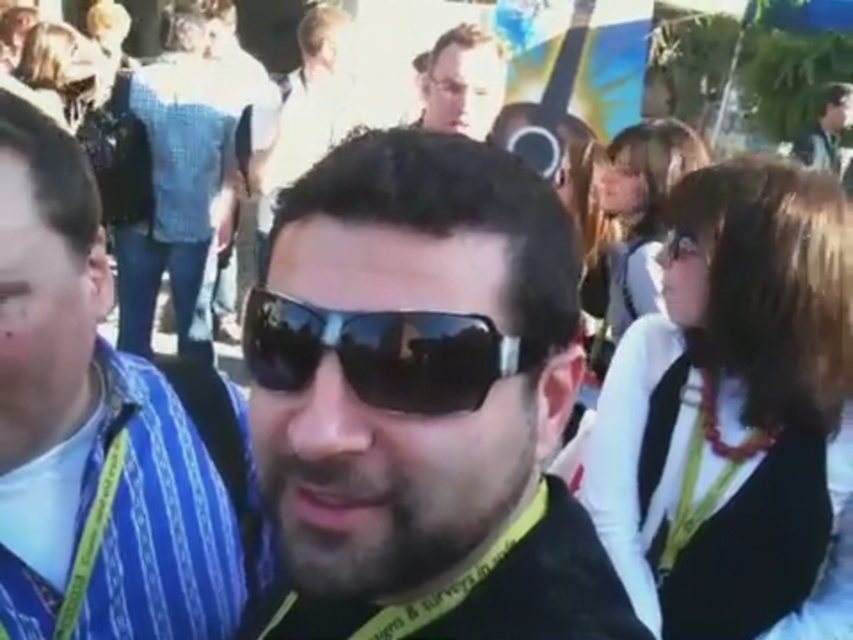
You are a GUI agent. You are given a task and a screenshot of the screen. Output one action in this format:
    pyautogui.click(x=<x>, y=<y>)
    Task: Click on the blue striped shirt at left
    Image resolution: width=853 pixels, height=640 pixels.
    Given the screenshot: What is the action you would take?
    pyautogui.click(x=96, y=417)

The height and width of the screenshot is (640, 853). What do you see at coordinates (96, 417) in the screenshot?
I see `blue striped shirt at left` at bounding box center [96, 417].

Identify the location of blue striped shirt at left. Image resolution: width=853 pixels, height=640 pixels. (96, 417).

Who is more forward, (247, 320) or (492, 108)?

Point (247, 320) is in front.

Is black reflective sunglasses at center closer to camera compared to matte black hair at upper center?

Yes.

Is point (344, 374) behind point (440, 109)?

That is False.

Where is `black reflective sunglasses at center`? black reflective sunglasses at center is located at coordinates (383, 353).

Between black matte sunglasses at center and black reflective sunglasses at center, which one appears on the right side from the viewer's perspective?

black matte sunglasses at center is more to the right.

Does point (517, 422) come behind point (293, 365)?

That is True.

Where is `black matte sunglasses at center`? The image size is (853, 640). black matte sunglasses at center is located at coordinates (422, 397).